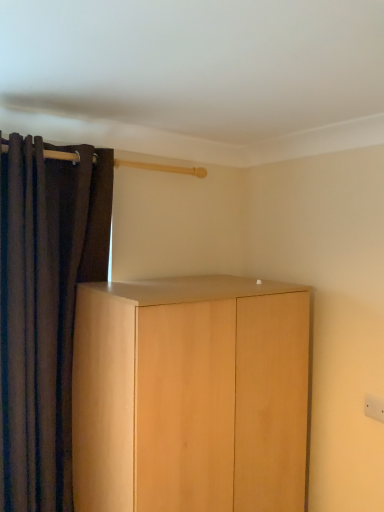
What do you see at coordinates (45, 308) in the screenshot? I see `brown velvet curtain at left` at bounding box center [45, 308].

I want to click on brown velvet curtain at left, so pos(45,308).

What is the approximate height of brown velvet curtain at left?

1.46 meters.

Measure the distance between brown velvet curtain at left and camera.

4.64 feet.

Locate an element on the screen. Image resolution: width=384 pixels, height=512 pixels. light wood cabinet at center is located at coordinates (190, 395).

What do you see at coordinates (190, 395) in the screenshot? This screenshot has width=384, height=512. I see `light wood cabinet at center` at bounding box center [190, 395].

I want to click on brown velvet curtain at left, so click(x=45, y=308).

Which is more to the left, light wood cabinet at center or brown velvet curtain at left?

Positioned to the left is brown velvet curtain at left.

Which object is further away from the camera, light wood cabinet at center or brown velvet curtain at left?

brown velvet curtain at left is further away from the camera.

Is point (145, 303) closer to viewer compared to point (66, 178)?

Yes, point (145, 303) is closer to viewer.

From the image's perspective, would you say light wood cabinet at center is shown under brown velvet curtain at left?

Indeed, from the image's perspective, light wood cabinet at center is shown beneath brown velvet curtain at left.

From a real-world perspective, which is physically above, light wood cabinet at center or brown velvet curtain at left?

brown velvet curtain at left, from a real-world perspective.

Does light wood cabinet at center have a lesser width compared to brown velvet curtain at left?

No.

Considering the sizes of objects light wood cabinet at center and brown velvet curtain at left in the image provided, who is taller, light wood cabinet at center or brown velvet curtain at left?

With more height is brown velvet curtain at left.

Considering the sizes of objects light wood cabinet at center and brown velvet curtain at left in the image provided, who is smaller, light wood cabinet at center or brown velvet curtain at left?

Smaller between the two is brown velvet curtain at left.

Is light wood cabinet at center positioned beyond the bounds of brown velvet curtain at left?

Yes, light wood cabinet at center is outside of brown velvet curtain at left.

Is light wood cabinet at center not near brown velvet curtain at left?

No.

Is light wood cabinet at center oriented towards brown velvet curtain at left?

No.

At what (x,y) coordinates should I click in order to perform the action: click on cabinetry in front of the brown velvet curtain at left. Please return your answer as a coordinate pair (x, y). The height and width of the screenshot is (512, 384). Looking at the image, I should click on (190, 395).

Considering the relative positions of brown velvet curtain at left and light wood cabinet at center in the image provided, is brown velvet curtain at left to the left of light wood cabinet at center from the viewer's perspective?

Yes.

Considering the relative positions of brown velvet curtain at left and light wood cabinet at center in the image provided, is brown velvet curtain at left behind light wood cabinet at center?

Yes, brown velvet curtain at left is further from the viewer.

Which is in front, point (13, 317) or point (148, 303)?

Positioned in front is point (148, 303).

From the image's perspective, is brown velvet curtain at left located above or below light wood cabinet at center?

Based on their image positions, brown velvet curtain at left is located above light wood cabinet at center.

From a real-world perspective, between brown velvet curtain at left and light wood cabinet at center, who is vertically lower?

From a 3D spatial view, light wood cabinet at center is below.

Is brown velvet curtain at left thinner than light wood cabinet at center?

Yes.

Who is shorter, brown velvet curtain at left or light wood cabinet at center?

Standing shorter between the two is light wood cabinet at center.

Consider the image. Who is bigger, brown velvet curtain at left or light wood cabinet at center?

light wood cabinet at center.

Could light wood cabinet at center be considered to be inside brown velvet curtain at left?

Actually, light wood cabinet at center is outside brown velvet curtain at left.

Are brown velvet curtain at left and light wood cabinet at center far apart?

No, brown velvet curtain at left is not far away from light wood cabinet at center.

Is brown velvet curtain at left facing away from light wood cabinet at center?

brown velvet curtain at left is not turned away from light wood cabinet at center.

How different are the orientations of brown velvet curtain at left and light wood cabinet at center in degrees?

There is a 0.367-degree angle between the facing directions of brown velvet curtain at left and light wood cabinet at center.

How distant is brown velvet curtain at left from light wood cabinet at center?

16.68 inches.

Where is `curtain lying on the left of light wood cabinet at center`? Image resolution: width=384 pixels, height=512 pixels. curtain lying on the left of light wood cabinet at center is located at coordinates (45, 308).

The width and height of the screenshot is (384, 512). What are the coordinates of `cabinetry directly beneath the brown velvet curtain at left (from a real-world perspective)` in the screenshot? It's located at (x=190, y=395).

This screenshot has height=512, width=384. In order to click on curtain located behind the light wood cabinet at center in this screenshot , I will do `click(45, 308)`.